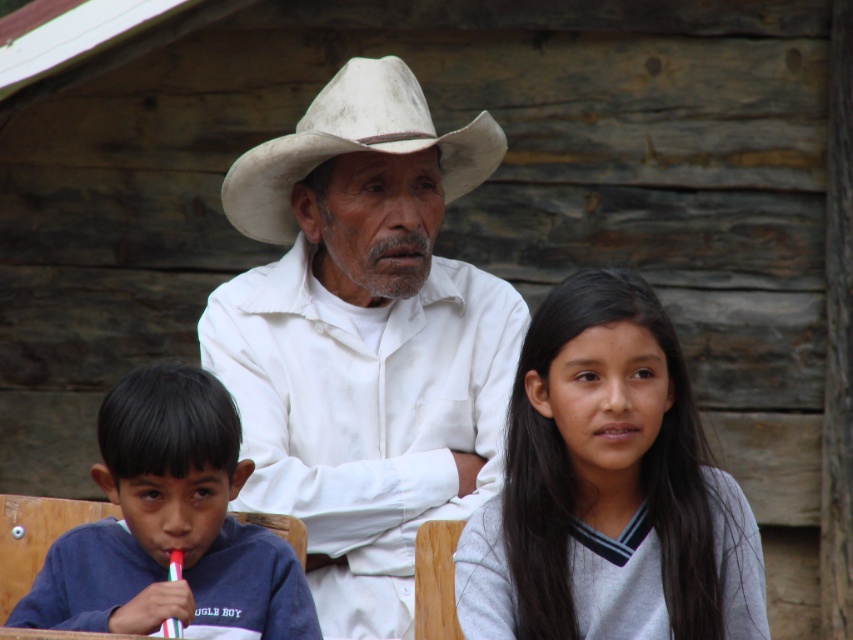
Question: Can you confirm if blue cotton shirt at lower left is positioned below white felt cowboy hat at center?

Choices:
 (A) no
 (B) yes

Answer: (B)

Question: Is blue cotton shirt at lower left below white felt cowboy hat at center?

Choices:
 (A) no
 (B) yes

Answer: (B)

Question: Can you confirm if white matte hat at center is bigger than blue cotton shirt at lower left?

Choices:
 (A) no
 (B) yes

Answer: (B)

Question: Which point is closer to the camera taking this photo?

Choices:
 (A) click(421, 108)
 (B) click(660, 529)
 (C) click(270, 237)

Answer: (B)

Question: Which point is closer to the camera?

Choices:
 (A) white felt cowboy hat at center
 (B) gray matte sweater at center
 (C) white matte hat at center

Answer: (B)

Question: Which is nearer to the white matte hat at center?

Choices:
 (A) white felt cowboy hat at center
 (B) blue cotton shirt at lower left

Answer: (A)